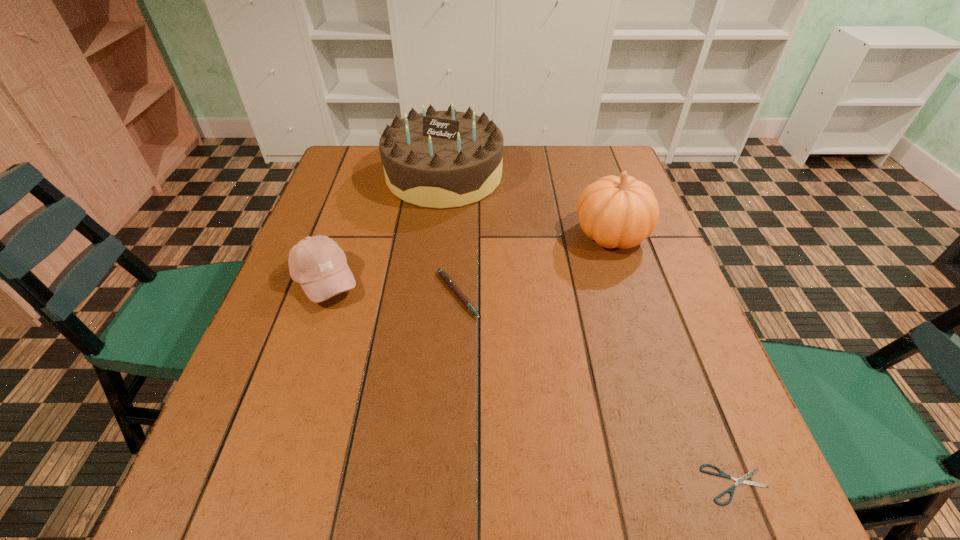
Where is `free location at the far right corner of the desktop`? free location at the far right corner of the desktop is located at coordinates (595, 155).

The width and height of the screenshot is (960, 540). I want to click on vacant space that is in between the baseball cap and the pen, so click(x=392, y=288).

Where is `free space that is in between the second shortest object and the pumpkin`? free space that is in between the second shortest object and the pumpkin is located at coordinates (535, 265).

Image resolution: width=960 pixels, height=540 pixels. Find the location of `empty space that is in between the birthday cake and the shears`. empty space that is in between the birthday cake and the shears is located at coordinates (590, 330).

Locate an element on the screen. free space between the pumpkin and the pen is located at coordinates coord(535,265).

This screenshot has width=960, height=540. What are the coordinates of `unoccupied area between the baseball cap and the pumpkin` in the screenshot? It's located at (x=468, y=258).

Identify the location of free space between the pen and the pumpkin. (535, 265).

Find the location of a particular element. The image size is (960, 540). vacant region between the shortest object and the farthest object is located at coordinates (590, 330).

Where is `free area in between the birthday cake and the baseball cap`? The height and width of the screenshot is (540, 960). free area in between the birthday cake and the baseball cap is located at coordinates (385, 228).

Where is `free space that is in between the shears and the baseball cap`? Image resolution: width=960 pixels, height=540 pixels. free space that is in between the shears and the baseball cap is located at coordinates (531, 382).